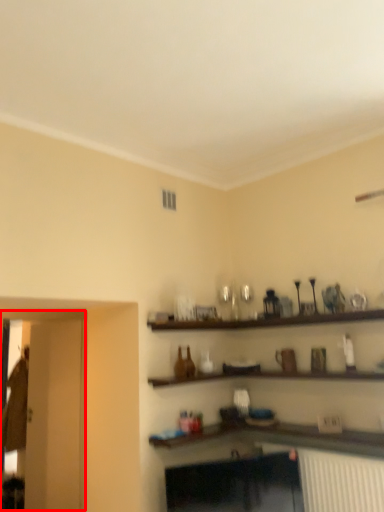
Question: From the image's perspective, what is the correct spatial positioning of glass door (annotated by the red box) in reference to glass door?

Choices:
 (A) above
 (B) below

Answer: (A)